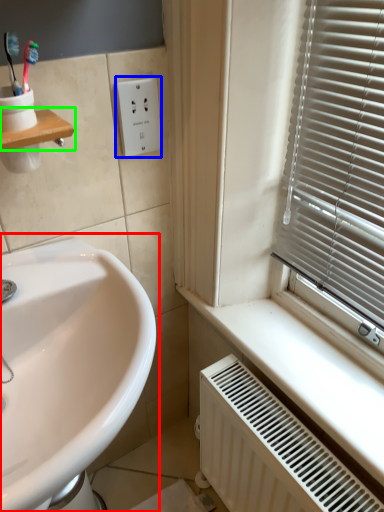
Question: Considering the real-world distances, which object is farthest from sink (highlighted by a red box)? electric outlet (highlighted by a blue box) or window sill (highlighted by a green box)?

Choices:
 (A) electric outlet
 (B) window sill

Answer: (A)